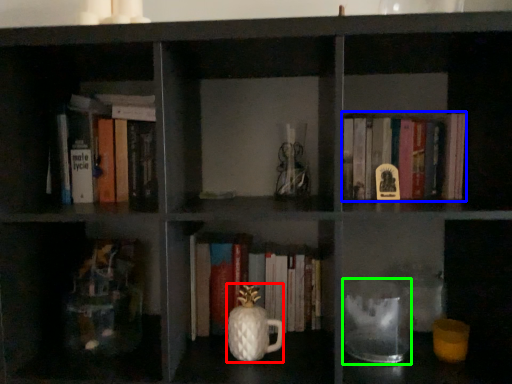
Question: Which object is positioned farthest from glass vase (highlighted by a red box)? Select from book (highlighted by a blue box) and glass jar (highlighted by a green box).

Choices:
 (A) book
 (B) glass jar

Answer: (A)